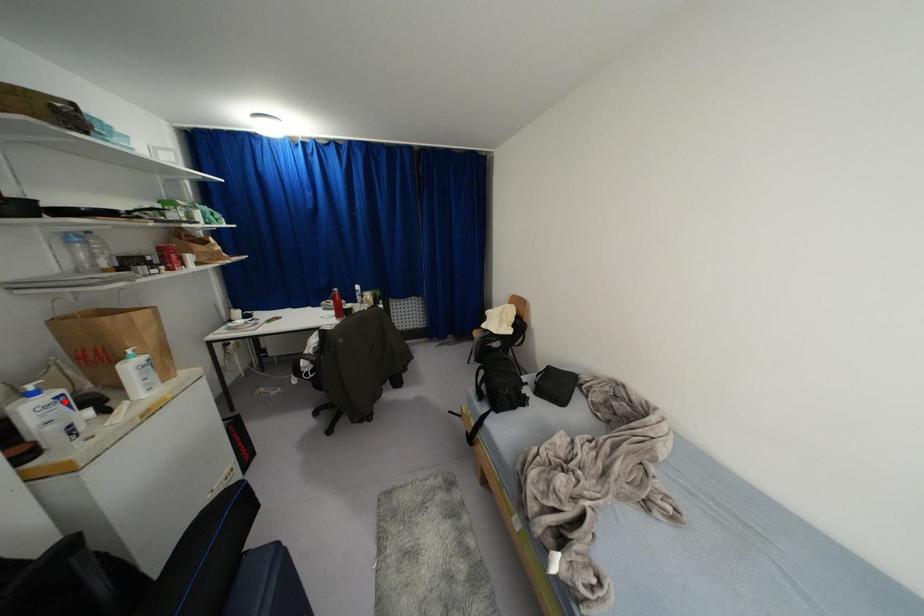
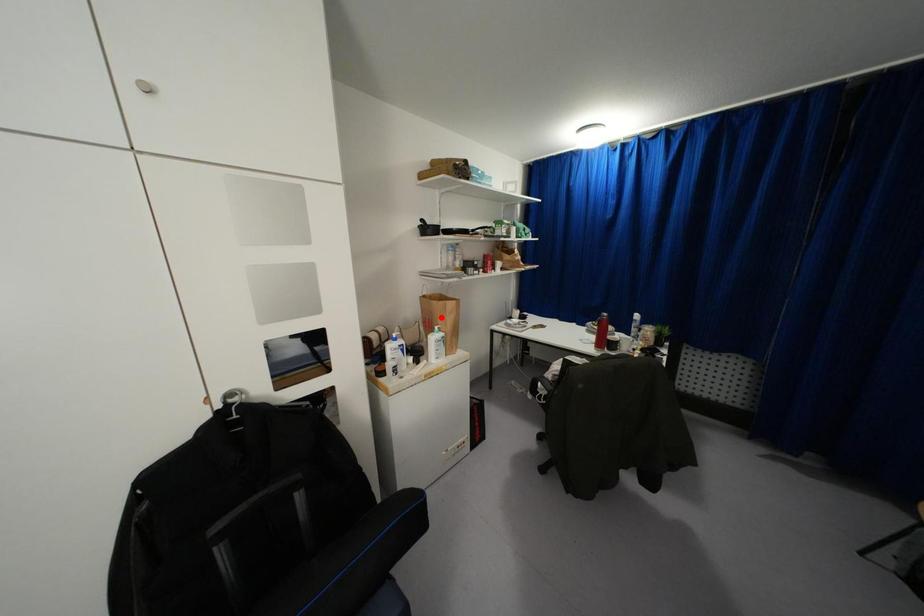
I am providing you with two images of the same scene from different viewpoints. A red point is marked on the first image and another point is marked on the second image. Are the points marked in image1 and image2 representing the same 3D position?

No